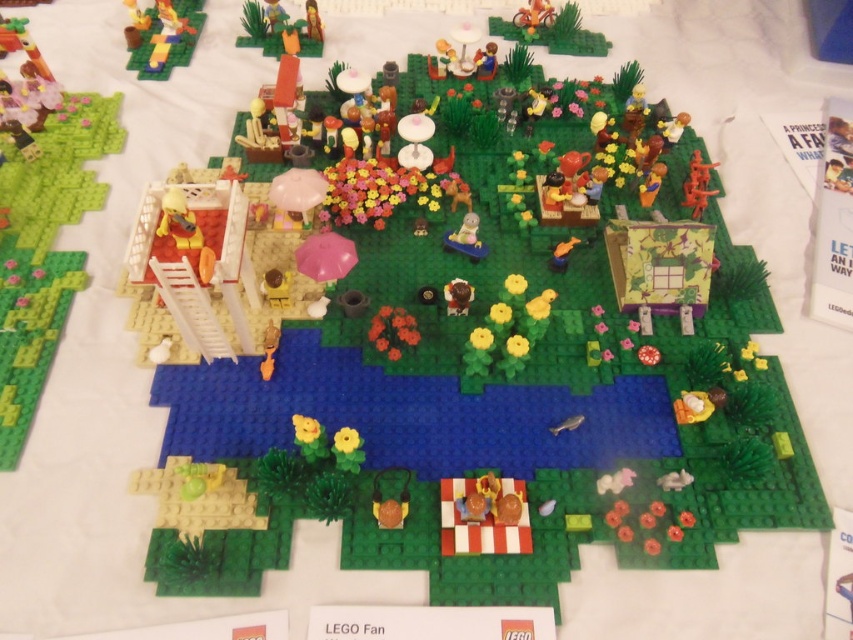
You are a LEGO enthusiast examining the diorama. You notice the matte yellow figure at upper left and the brown matte teddy bear at center. Which of these two objects is taller?

The matte yellow figure at upper left is taller than the brown matte teddy bear at center according to the description provided.

Looking at this image, you are a tiny LEGO figure standing at the edge of the pond in the center of the diorama. You want to move towards the point labeled as point (471, 291). However, there is an obstacle at point (189, 49). Can you safely walk from your current position to the target point without hitting the obstacle?

Point (189, 49) is closer to you than point (471, 291), so the obstacle at point (189, 49) is in your path. You cannot safely walk to the target point without encountering the obstacle.

You are a small LEGO figure trying to reach the brown matte teddy bear at center from the matte yellow figure at upper left. Can you walk directly to it without stepping on any LEGO bricks?

The matte yellow figure at upper left is positioned over the brown matte teddy bear at center, so you cannot walk directly to it without stepping on the LEGO bricks beneath them.